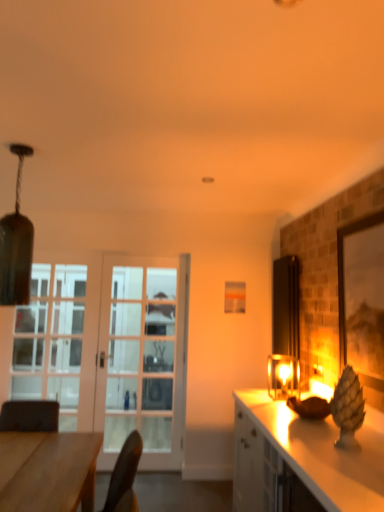
Question: Considering the relative positions of clear glass door at left and matte glass lampshade at upper left in the image provided, is clear glass door at left to the left of matte glass lampshade at upper left from the viewer's perspective?

Choices:
 (A) no
 (B) yes

Answer: (B)

Question: From the image's perspective, would you say clear glass door at left is shown under matte glass lampshade at upper left?

Choices:
 (A) no
 (B) yes

Answer: (B)

Question: Would you say matte glass lampshade at upper left is part of clear glass door at left's contents?

Choices:
 (A) yes
 (B) no

Answer: (B)

Question: Is clear glass door at left aimed at matte glass lampshade at upper left?

Choices:
 (A) no
 (B) yes

Answer: (B)

Question: Is clear glass door at left bigger than matte glass lampshade at upper left?

Choices:
 (A) no
 (B) yes

Answer: (B)

Question: From a real-world perspective, is white glossy cabinet at right physically located above or below clear glass door at left?

Choices:
 (A) below
 (B) above

Answer: (A)

Question: Looking at the image, does white glossy cabinet at right seem bigger or smaller compared to clear glass door at left?

Choices:
 (A) small
 (B) big

Answer: (B)

Question: Considering their positions, is white glossy cabinet at right located in front of or behind clear glass door at left?

Choices:
 (A) behind
 (B) front

Answer: (B)

Question: Is point (264, 437) positioned closer to the camera than point (26, 351)?

Choices:
 (A) closer
 (B) farther

Answer: (A)

Question: From a real-world perspective, relative to matte glass lampshade at upper left, is white glossy cabinet at right vertically above or below?

Choices:
 (A) below
 (B) above

Answer: (A)

Question: Considering the positions of white glossy cabinet at right and matte glass lampshade at upper left in the image, is white glossy cabinet at right wider or thinner than matte glass lampshade at upper left?

Choices:
 (A) wide
 (B) thin

Answer: (A)

Question: Considering the positions of white glossy cabinet at right and matte glass lampshade at upper left in the image, is white glossy cabinet at right taller or shorter than matte glass lampshade at upper left?

Choices:
 (A) tall
 (B) short

Answer: (B)

Question: Relative to matte glass lampshade at upper left, is white glossy cabinet at right in front or behind?

Choices:
 (A) behind
 (B) front

Answer: (B)

Question: Considering the positions of point (89, 484) and point (296, 479), is point (89, 484) closer or farther from the camera than point (296, 479)?

Choices:
 (A) farther
 (B) closer

Answer: (A)

Question: In terms of size, does wooden desk at lower left appear bigger or smaller than white glossy cabinet at right?

Choices:
 (A) big
 (B) small

Answer: (B)